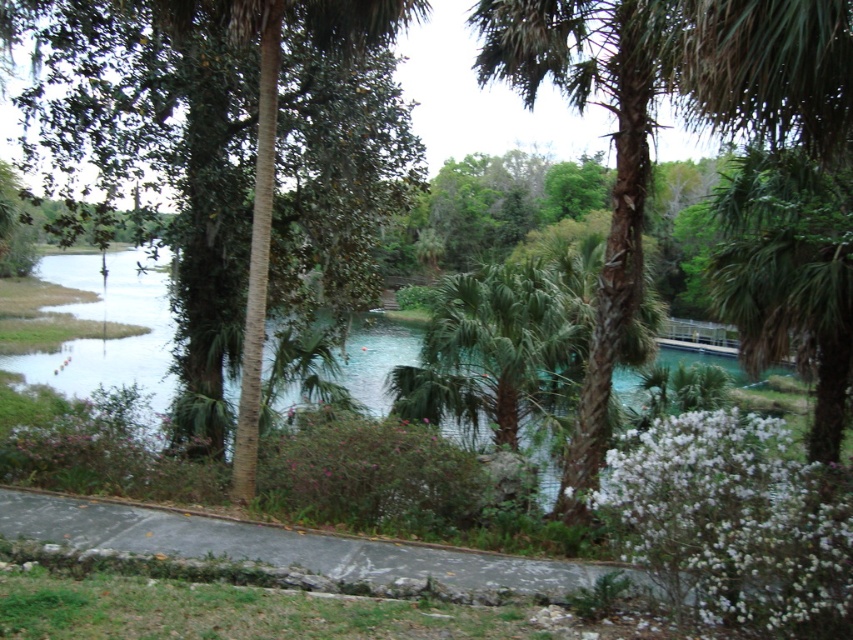
Consider the image. Can you confirm if green leafy palm tree at center is shorter than green leafy palm tree at left?

No, green leafy palm tree at center is not shorter than green leafy palm tree at left.

Describe the element at coordinates (494, 349) in the screenshot. I see `green leafy palm tree at center` at that location.

Which is in front, point (442, 369) or point (238, 476)?

Point (238, 476) is in front.

Where is `green leafy palm tree at center`? The height and width of the screenshot is (640, 853). green leafy palm tree at center is located at coordinates (494, 349).

Who is shorter, brown textured palm tree at center or green leafy palm tree at center?

green leafy palm tree at center

Is brown textured palm tree at center taller than green leafy palm tree at center?

Yes, brown textured palm tree at center is taller than green leafy palm tree at center.

Is point (639, 257) farther from camera compared to point (424, 353)?

No, (639, 257) is in front of (424, 353).

Identify the location of brown textured palm tree at center. The image size is (853, 640). (614, 156).

Is brown textured palm tree at center below green leafy palm tree at left?

No.

Can you confirm if brown textured palm tree at center is smaller than green leafy palm tree at left?

No, brown textured palm tree at center is not smaller than green leafy palm tree at left.

This screenshot has height=640, width=853. What do you see at coordinates (614, 156) in the screenshot? I see `brown textured palm tree at center` at bounding box center [614, 156].

Where is `brown textured palm tree at center`? brown textured palm tree at center is located at coordinates (614, 156).